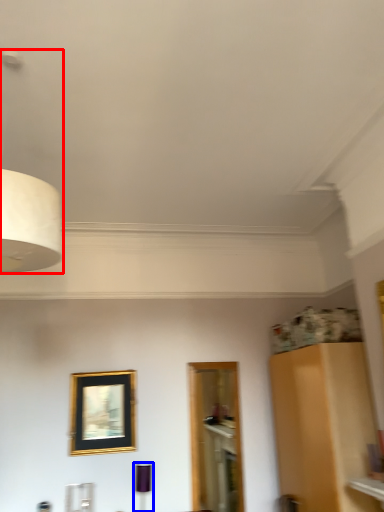
Question: Which of the following is the farthest to the observer, lamp (highlighted by a red box) or lamp (highlighted by a blue box)?

Choices:
 (A) lamp
 (B) lamp

Answer: (B)